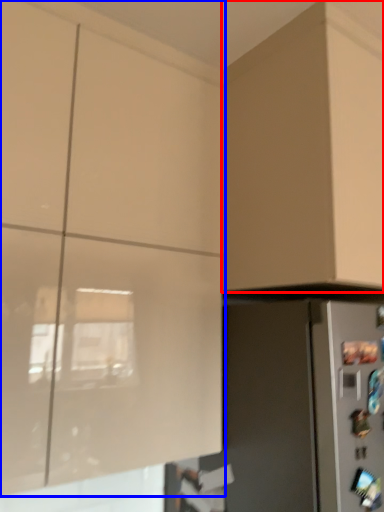
Question: Which object appears closest to the camera in this image, cabinetry (highlighted by a red box) or cabinetry (highlighted by a blue box)?

Choices:
 (A) cabinetry
 (B) cabinetry

Answer: (B)